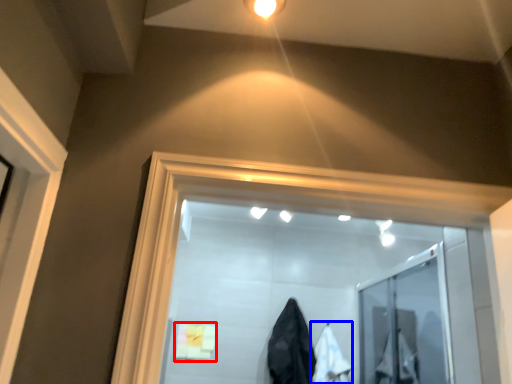
Question: Among these objects, which one is farthest to the camera, bath towel (highlighted by a red box) or garment (highlighted by a blue box)?

Choices:
 (A) bath towel
 (B) garment

Answer: (A)